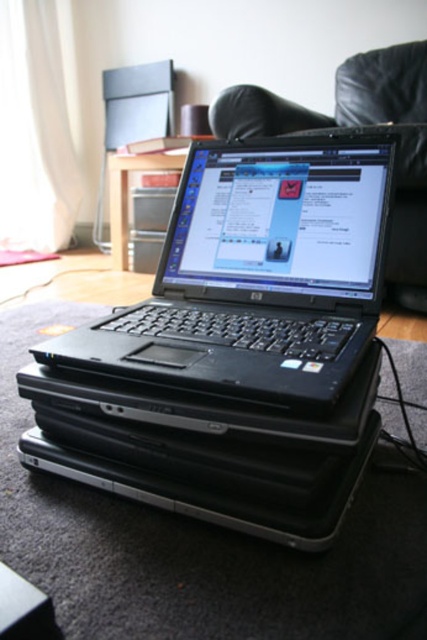
You are standing in the room and want to pick up an object. Which of the two points, point (202, 179) or point (398, 192), is closer to you?

Point (202, 179) is closer to the camera than point (398, 192), so it is closer to you.

You are a technician trying to locate the black matte laptop at center in the image. According to the coordinates provided, where exactly is it positioned?

The black matte laptop at center is located at point coordinates of (257,275).

You are trying to determine which laptop is taller between the black matte laptop at center and the black plastic laptop at center. Based on the scene, which one is taller?

The black matte laptop at center is taller than the black plastic laptop at center according to the description.